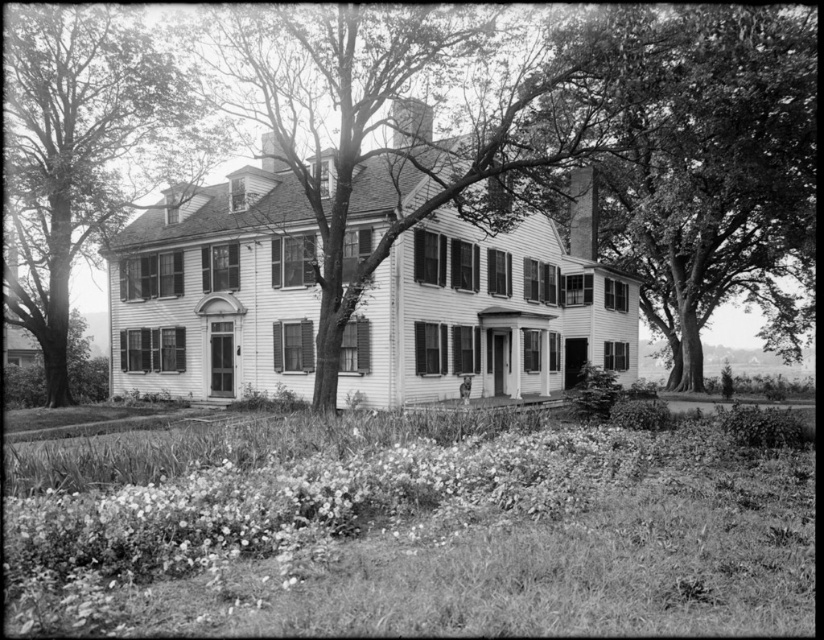
Question: Can you confirm if smooth bark tree at center is wider than smooth bark tree at left?

Choices:
 (A) no
 (B) yes

Answer: (B)

Question: Which point is farther from the camera taking this photo?

Choices:
 (A) (326, 170)
 (B) (85, 22)

Answer: (B)

Question: Does smooth bark tree at center appear on the left side of smooth bark tree at left?

Choices:
 (A) yes
 (B) no

Answer: (B)

Question: Which point is farther to the camera?

Choices:
 (A) smooth bark tree at left
 (B) smooth bark tree at center

Answer: (A)

Question: Can you confirm if smooth bark tree at center is positioned to the right of smooth bark tree at left?

Choices:
 (A) yes
 (B) no

Answer: (A)